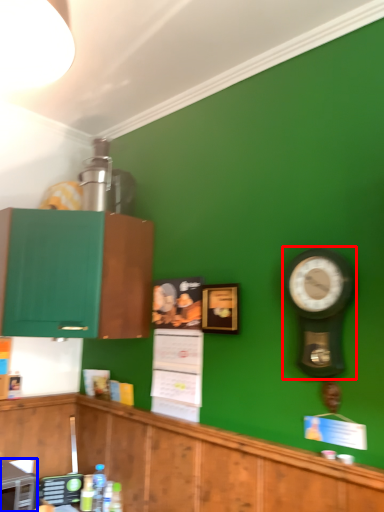
Question: Which object is closer to the camera taking this photo, clock (highlighted by a red box) or appliance (highlighted by a blue box)?

Choices:
 (A) clock
 (B) appliance

Answer: (A)